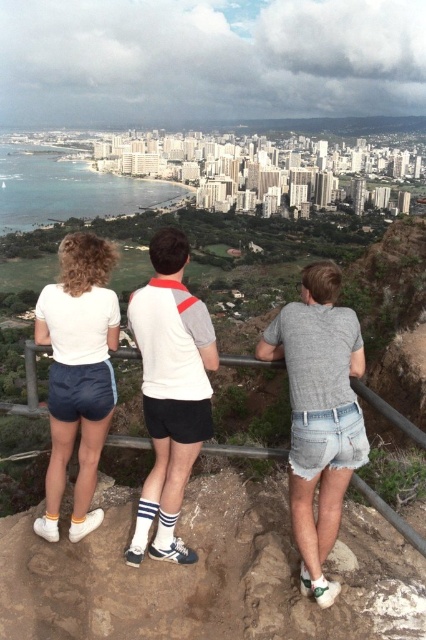
Question: Based on their relative distances, which object is nearer to the white matte shorts at left?

Choices:
 (A) white fabric shirt at center
 (B) denim shorts at center

Answer: (A)

Question: Can you confirm if white fabric shirt at center is positioned above metallic gray rail at center?

Choices:
 (A) yes
 (B) no

Answer: (A)

Question: Estimate the real-world distances between objects in this image. Which object is closer to the white fabric shirt at center?

Choices:
 (A) white matte shorts at left
 (B) metallic gray rail at center
 (C) denim shorts at center

Answer: (A)

Question: Is white fabric shirt at center wider than metallic gray rail at center?

Choices:
 (A) yes
 (B) no

Answer: (B)

Question: Does white matte shorts at left appear on the left side of metallic gray rail at center?

Choices:
 (A) no
 (B) yes

Answer: (B)

Question: Among these points, which one is nearest to the camera?

Choices:
 (A) (88, 388)
 (B) (304, 285)
 (C) (152, 292)

Answer: (A)